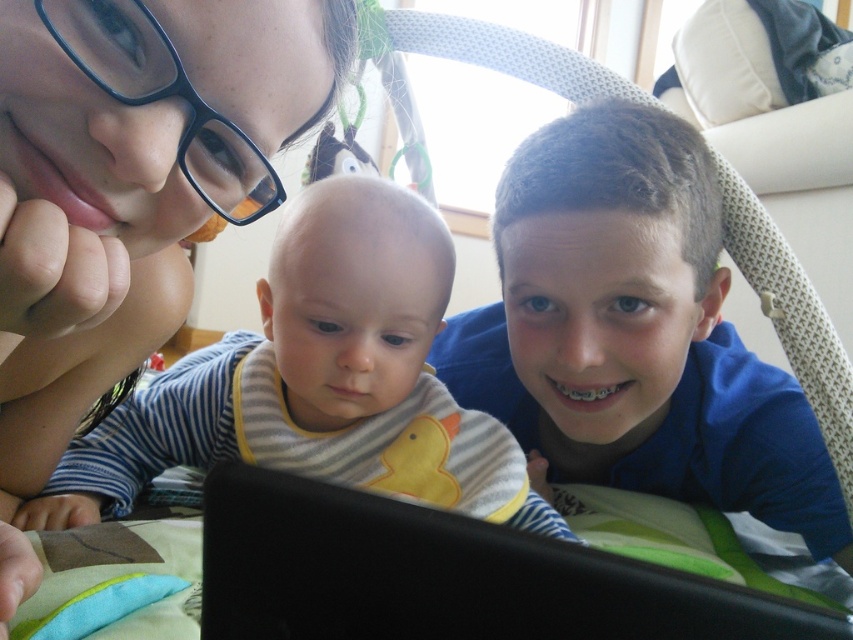
Question: Which object is positioned closest to the striped fabric bib at center?

Choices:
 (A) black matte laptop at center
 (B) blue cotton shirt at right

Answer: (B)

Question: Is matte black glasses at upper left further to camera compared to black matte laptop at center?

Choices:
 (A) yes
 (B) no

Answer: (A)

Question: Which object is the farthest from the matte black glasses at upper left?

Choices:
 (A) black matte laptop at center
 (B) blue cotton shirt at right

Answer: (B)

Question: Which object is positioned closest to the blue cotton shirt at right?

Choices:
 (A) striped fabric bib at center
 (B) matte black glasses at upper left
 (C) black matte laptop at center

Answer: (A)

Question: Does blue cotton shirt at right have a lesser width compared to black matte laptop at center?

Choices:
 (A) no
 (B) yes

Answer: (A)

Question: Is striped fabric bib at center wider than black matte laptop at center?

Choices:
 (A) no
 (B) yes

Answer: (B)